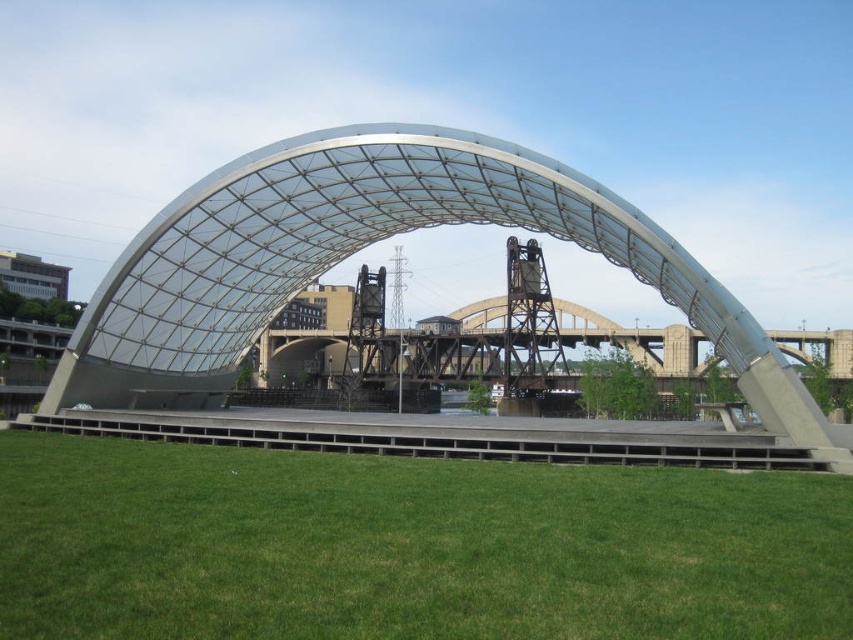
Question: Which of the following is the closest to the observer?

Choices:
 (A) green grass at lower center
 (B) transparent glass dome at center

Answer: (A)

Question: Can you confirm if green grass at lower center is bigger than transparent glass dome at center?

Choices:
 (A) yes
 (B) no

Answer: (B)

Question: Does green grass at lower center appear under transparent glass dome at center?

Choices:
 (A) no
 (B) yes

Answer: (B)

Question: Can you confirm if green grass at lower center is smaller than transparent glass dome at center?

Choices:
 (A) no
 (B) yes

Answer: (B)